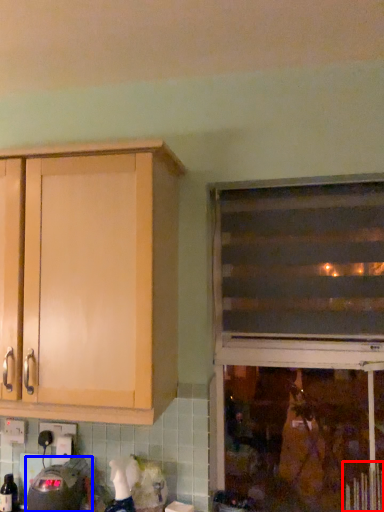
Question: Which object is further to the camera taking this photo, radiator (highlighted by a red box) or appliance (highlighted by a blue box)?

Choices:
 (A) radiator
 (B) appliance

Answer: (B)